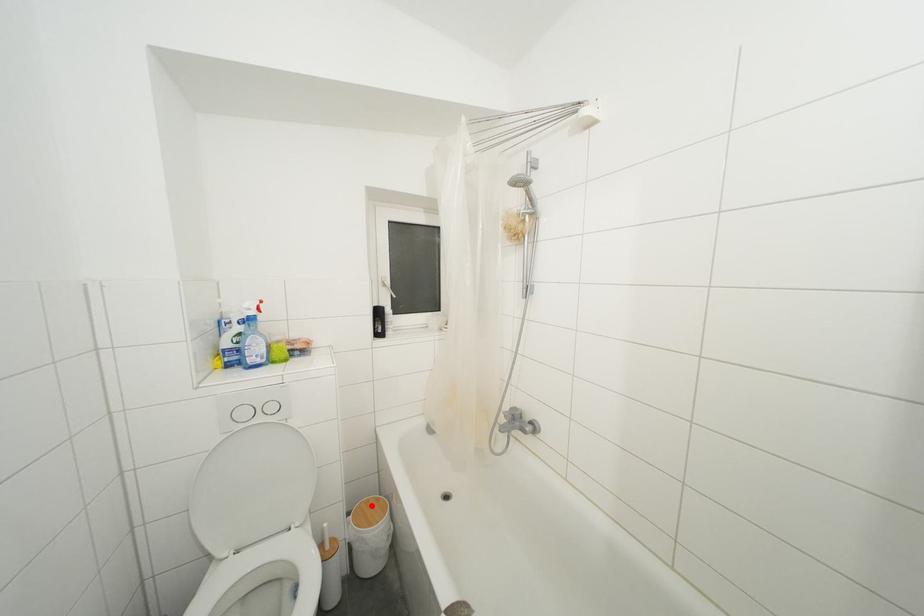
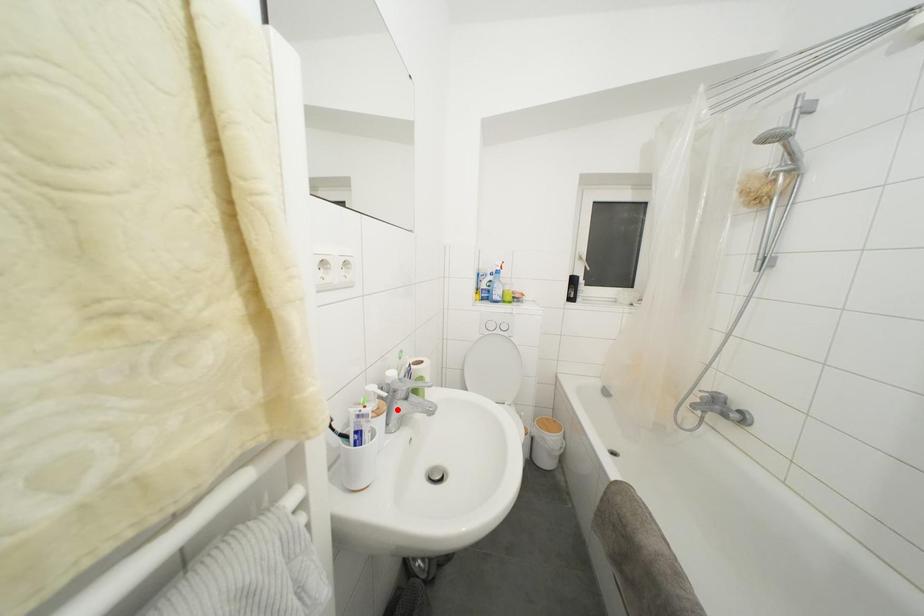
I am providing you with two images of the same scene from different viewpoints. A red point is marked on the first image and another point is marked on the second image. Is the red point in image1 aligned with the point shown in image2?

No